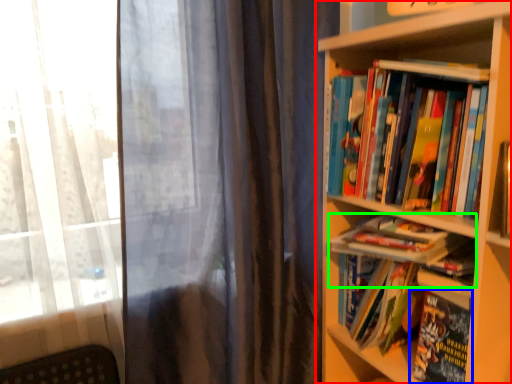
Question: Considering the real-world distances, which object is farthest from bookcase (highlighted by a red box)? book (highlighted by a blue box) or book (highlighted by a green box)?

Choices:
 (A) book
 (B) book

Answer: (A)